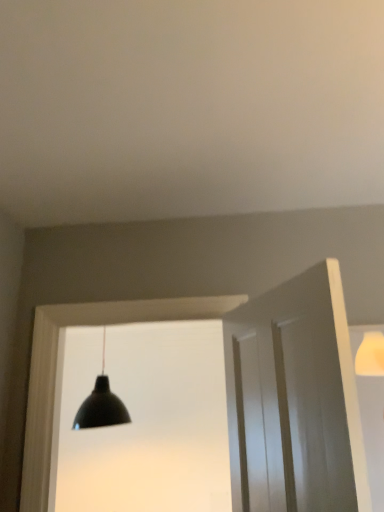
Measure the distance between point (306, 351) and camera.

The distance of point (306, 351) from camera is 3.96 feet.

In order to face white smooth door at right, should I rotate leftwards or rightwards?

Rotate right and turn 10.947 degrees.

In order to face black matte lamp at center, should I rotate leftwards or rightwards?

To align with it, rotate left about 11.549°.

Locate an element on the screen. This screenshot has width=384, height=512. white wood door frame at center is located at coordinates (226, 372).

Find the location of `white smooth door at right`. white smooth door at right is located at coordinates (294, 400).

Considering the positions of objects white smooth door at right and black matte lamp at center in the image provided, who is behind, white smooth door at right or black matte lamp at center?

black matte lamp at center.

From a real-world perspective, relative to black matte lamp at center, is white smooth door at right vertically above or below?

white smooth door at right is situated lower than black matte lamp at center in the real world.

Consider the image. Considering the sizes of objects white smooth door at right and black matte lamp at center in the image provided, who is bigger, white smooth door at right or black matte lamp at center?

With larger size is black matte lamp at center.

Is white wood door frame at center completely or partially outside of white smooth door at right?

Yes.

Are white wood door frame at center and white smooth door at right far apart?

No, white wood door frame at center is in close proximity to white smooth door at right.

Is point (55, 342) positioned after point (250, 347)?

Yes, point (55, 342) is behind point (250, 347).

Looking at this image, from a real-world perspective, is white wood door frame at center above or below white smooth door at right?

From a real-world perspective, white wood door frame at center is physically above white smooth door at right.

How distant is white wood door frame at center from black matte lamp at center?

The distance of white wood door frame at center from black matte lamp at center is 7.16 feet.

Is white wood door frame at center facing away from black matte lamp at center?

Yes, white wood door frame at center's orientation is away from black matte lamp at center.

Considering the relative sizes of white wood door frame at center and black matte lamp at center in the image provided, is white wood door frame at center smaller than black matte lamp at center?

Yes.

Locate an element on the screen. lamp above the white wood door frame at center (from a real-world perspective) is located at coordinates (101, 404).

How far apart are black matte lamp at center and white smooth door at right?

The distance of black matte lamp at center from white smooth door at right is 2.43 meters.

From a real-world perspective, which is physically below, black matte lamp at center or white smooth door at right?

From a 3D spatial view, white smooth door at right is below.

Which object is thinner, black matte lamp at center or white smooth door at right?

Thinner between the two is white smooth door at right.

Considering the sizes of objects black matte lamp at center and white smooth door at right in the image provided, who is bigger, black matte lamp at center or white smooth door at right?

Bigger between the two is black matte lamp at center.

From a real-world perspective, relative to white wood door frame at center, is white smooth door at right vertically above or below?

Clearly, from a real-world perspective, white smooth door at right is below white wood door frame at center.

Does white smooth door at right have a lesser height compared to white wood door frame at center?

Correct, white smooth door at right is not as tall as white wood door frame at center.

From the image's perspective, is white smooth door at right on top of white wood door frame at center?

Indeed, from the image's perspective, white smooth door at right is shown above white wood door frame at center.

Considering the positions of objects black matte lamp at center and white wood door frame at center in the image provided, who is more to the left, black matte lamp at center or white wood door frame at center?

black matte lamp at center.

From the picture: Which of these two, black matte lamp at center or white wood door frame at center, is wider?

Wider between the two is black matte lamp at center.

Image resolution: width=384 pixels, height=512 pixels. In order to click on lamp that appears behind the white wood door frame at center in this screenshot , I will do `click(101, 404)`.

From the image's perspective, who appears lower, black matte lamp at center or white wood door frame at center?

black matte lamp at center.

The image size is (384, 512). What are the coordinates of `door below the black matte lamp at center (from a real-world perspective)` in the screenshot? It's located at (294, 400).

I want to click on window frame that appears behind the white smooth door at right, so click(226, 372).

When comparing their distances from white smooth door at right, does black matte lamp at center or white wood door frame at center seem closer?

white wood door frame at center is closer to white smooth door at right.

Looking at the image, which one is located closer to black matte lamp at center, white wood door frame at center or white smooth door at right?

The object closer to black matte lamp at center is white wood door frame at center.

From the image, which object appears to be nearer to white wood door frame at center, white smooth door at right or black matte lamp at center?

Based on the image, white smooth door at right appears to be nearer to white wood door frame at center.

Considering their positions, is white wood door frame at center positioned further to white smooth door at right than black matte lamp at center?

black matte lamp at center is positioned further to the anchor white smooth door at right.

Based on their spatial positions, is white smooth door at right or white wood door frame at center further from black matte lamp at center?

Based on the image, white smooth door at right appears to be further to black matte lamp at center.

From the image, which object appears to be farther from white wood door frame at center, black matte lamp at center or white smooth door at right?

black matte lamp at center is positioned further to the anchor white wood door frame at center.

You are a GUI agent. You are given a task and a screenshot of the screen. Output one action in this format:
    pyautogui.click(x=<x>, y=<y>)
    Task: Click on the window frame located between white smooth door at right and black matte lamp at center in the depth direction
    The height and width of the screenshot is (512, 384).
    Given the screenshot: What is the action you would take?
    (x=226, y=372)